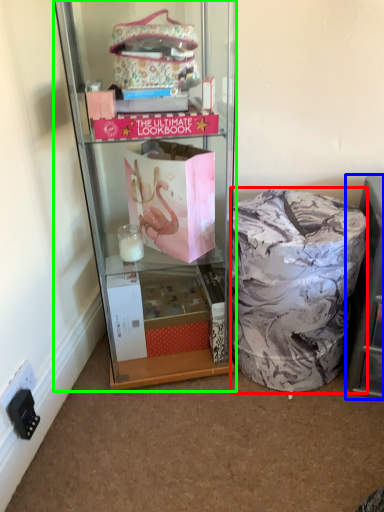
Question: Which is nearer to the material (highlighted by a red box)? shelf (highlighted by a blue box) or cabinetry (highlighted by a green box).

Choices:
 (A) shelf
 (B) cabinetry

Answer: (A)